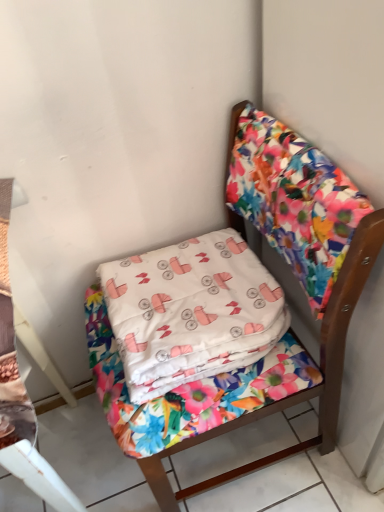
Question: Is white fabric pillow at center inside floral fabric chair at center?

Choices:
 (A) yes
 (B) no

Answer: (A)

Question: Is floral fabric chair at center bigger than white fabric pillow at center?

Choices:
 (A) no
 (B) yes

Answer: (B)

Question: Is floral fabric chair at center completely or partially outside of white fabric pillow at center?

Choices:
 (A) yes
 (B) no

Answer: (A)

Question: Is floral fabric chair at center in front of white fabric pillow at center?

Choices:
 (A) no
 (B) yes

Answer: (B)

Question: Is floral fabric chair at center aimed at white fabric pillow at center?

Choices:
 (A) yes
 (B) no

Answer: (A)

Question: Is white fabric pillow at center at the back of floral fabric chair at center?

Choices:
 (A) no
 (B) yes

Answer: (B)

Question: From a real-world perspective, is white fabric pillow at center beneath floral fabric chair at center?

Choices:
 (A) yes
 (B) no

Answer: (B)

Question: Can you confirm if white fabric pillow at center is wider than floral fabric chair at center?

Choices:
 (A) yes
 (B) no

Answer: (B)

Question: Is white fabric pillow at center closer to the viewer compared to floral fabric chair at center?

Choices:
 (A) yes
 (B) no

Answer: (B)

Question: Considering the relative positions of white fabric pillow at center and floral fabric chair at center in the image provided, is white fabric pillow at center to the right of floral fabric chair at center from the viewer's perspective?

Choices:
 (A) yes
 (B) no

Answer: (B)

Question: Does white fabric pillow at center have a lesser height compared to floral fabric chair at center?

Choices:
 (A) yes
 (B) no

Answer: (A)

Question: From the image's perspective, is white fabric pillow at center beneath floral fabric chair at center?

Choices:
 (A) yes
 (B) no

Answer: (B)

Question: Is floral fabric chair at center in front of or behind white fabric pillow at center in the image?

Choices:
 (A) front
 (B) behind

Answer: (A)